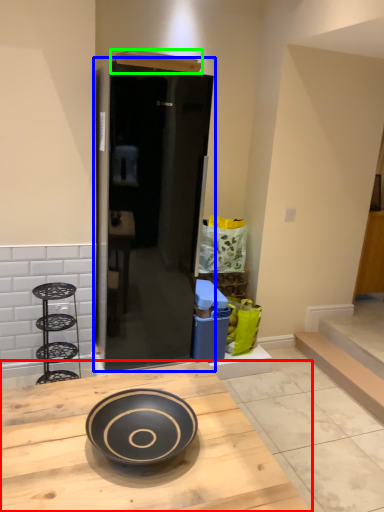
Question: Considering the real-world distances, which object is closest to kitchen & dining room table (highlighted by a red box)? door (highlighted by a blue box) or box (highlighted by a green box).

Choices:
 (A) door
 (B) box

Answer: (A)